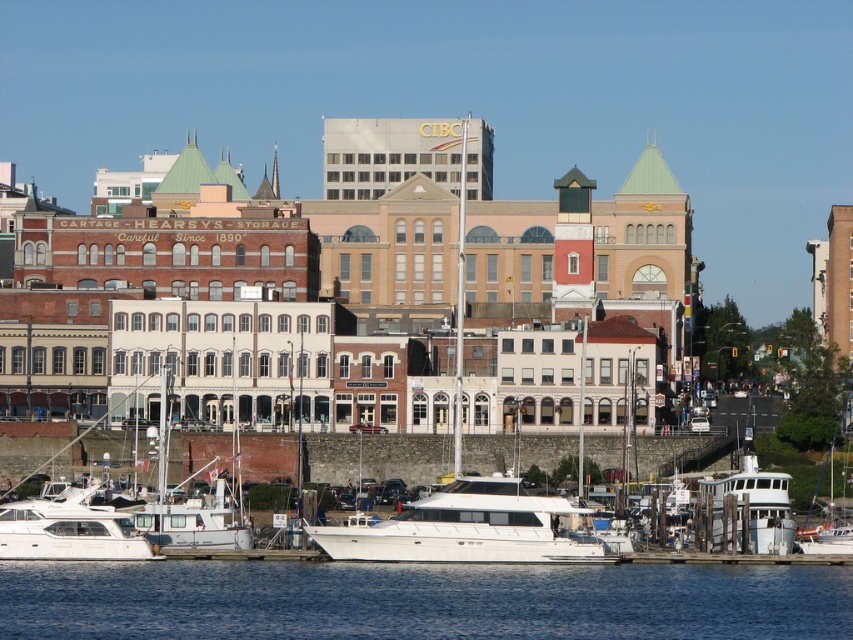
Who is more forward, (15,605) or (473,484)?

Point (15,605)

Between point (508, 632) and point (469, 522), which one is positioned in front?

Positioned in front is point (508, 632).

Where is `blue water at lower center`? The image size is (853, 640). blue water at lower center is located at coordinates (421, 600).

Is the position of blue water at lower center less distant than that of white glossy boat at lower left?

That is True.

Does point (90, 612) lie in front of point (90, 525)?

Yes, it is.

You are a GUI agent. You are given a task and a screenshot of the screen. Output one action in this format:
    pyautogui.click(x=<x>, y=<y>)
    Task: Click on the blue water at lower center
    This screenshot has width=853, height=640.
    Given the screenshot: What is the action you would take?
    pyautogui.click(x=421, y=600)

Identify the location of white glossy boat at center. Image resolution: width=853 pixels, height=640 pixels. (469, 480).

Who is positioned more to the left, white glossy boat at center or white glossy boat at lower left?

Positioned to the left is white glossy boat at lower left.

Which is behind, point (567, 214) or point (47, 518)?

Positioned behind is point (567, 214).

Where is `white glossy boat at center`? This screenshot has height=640, width=853. white glossy boat at center is located at coordinates (469, 480).